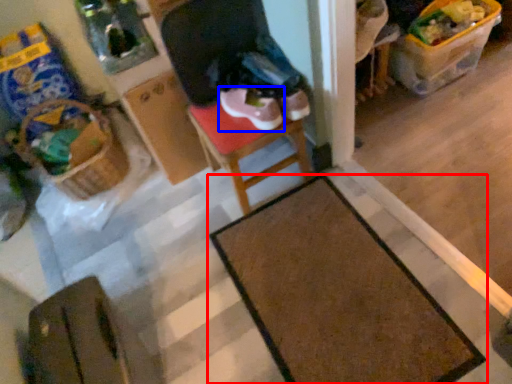
Question: Which object appears closest to the camera in this image, table (highlighted by a red box) or footwear (highlighted by a blue box)?

Choices:
 (A) table
 (B) footwear

Answer: (A)